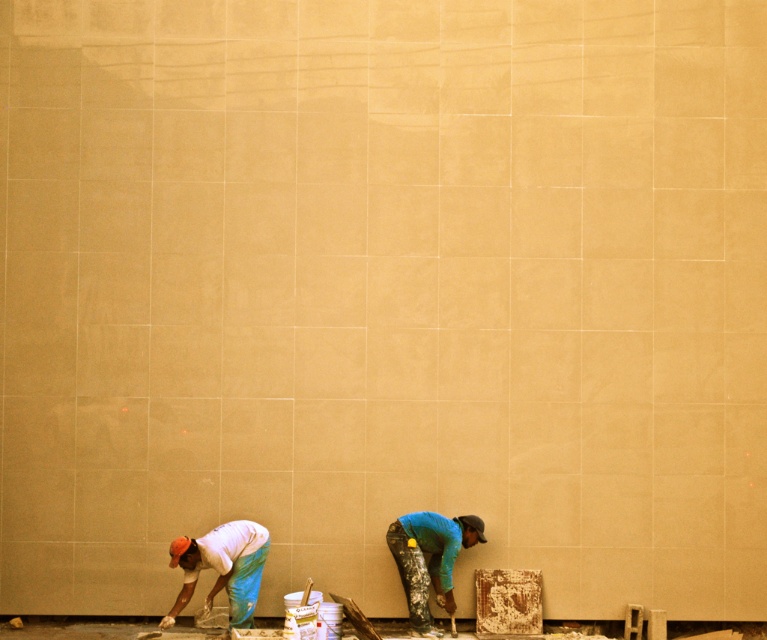
You are a supervisor observing two workers in the scene. The workers are wearing a white matte shirt at lower left and a blue fabric worker at lower center. Which worker is standing more to the left side of the scene?

The white matte shirt at lower left is positioned on the left side of blue fabric worker at lower center, so the worker wearing the white matte shirt at lower left is standing more to the left side of the scene.

You are standing at the camera position and see the point marked as point [221,556]. Can you reach this point by walking straight ahead without moving sideways?

The point [221,556] is 12.86 meters away from the camera, so yes, you can reach it by walking straight ahead since there is no mention of obstacles in the scene description.